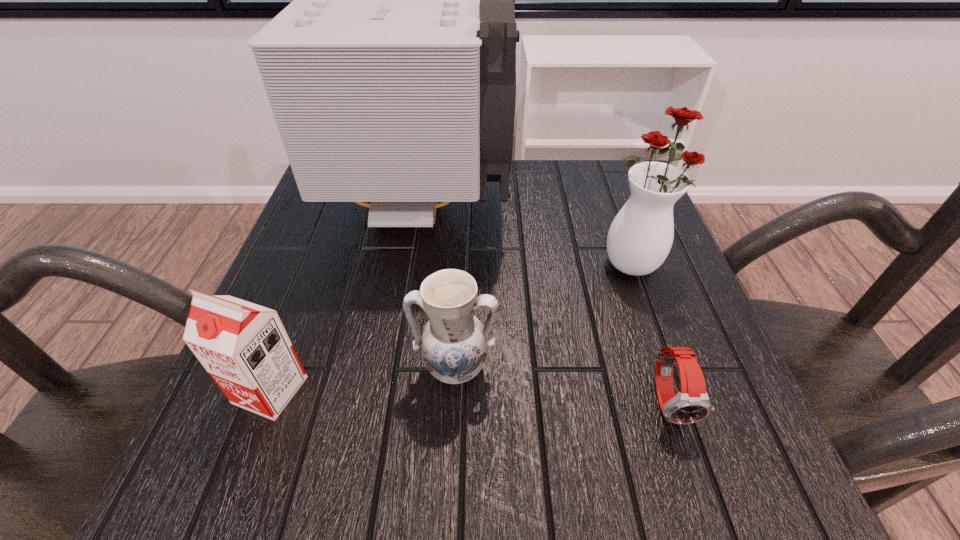
What are the coordinates of `vacant space at the far right corner of the desktop` in the screenshot? It's located at (612, 192).

The width and height of the screenshot is (960, 540). What are the coordinates of `empty space between the fourth shortest object and the tallest object` in the screenshot? It's located at (527, 234).

Locate an element on the screen. free space between the pottery and the soya milk is located at coordinates [363, 379].

You are a GUI agent. You are given a task and a screenshot of the screen. Output one action in this format:
    pyautogui.click(x=<x>, y=<y>)
    Task: Click on the free area in between the soya milk and the watch
    Image resolution: width=960 pixels, height=540 pixels.
    Given the screenshot: What is the action you would take?
    pyautogui.click(x=469, y=395)

Find the location of a particular element. Image resolution: width=960 pixels, height=540 pixels. vacant region between the shortest object and the pottery is located at coordinates (562, 384).

Locate an element on the screen. The height and width of the screenshot is (540, 960). free spot between the shortest object and the soya milk is located at coordinates (469, 395).

Image resolution: width=960 pixels, height=540 pixels. Identify the location of free space between the pottery and the vase. (544, 316).

Where is `vacant area that lies between the second tallest object and the shortest object`? This screenshot has width=960, height=540. vacant area that lies between the second tallest object and the shortest object is located at coordinates (651, 332).

Find the location of a particular element. The image size is (960, 540). vacant point located between the fan and the watch is located at coordinates (545, 303).

You are a GUI agent. You are given a task and a screenshot of the screen. Output one action in this format:
    pyautogui.click(x=<x>, y=<y>)
    Task: Click on the empty space between the shortest object and the soya milk
    This screenshot has width=960, height=540.
    Given the screenshot: What is the action you would take?
    pyautogui.click(x=469, y=395)